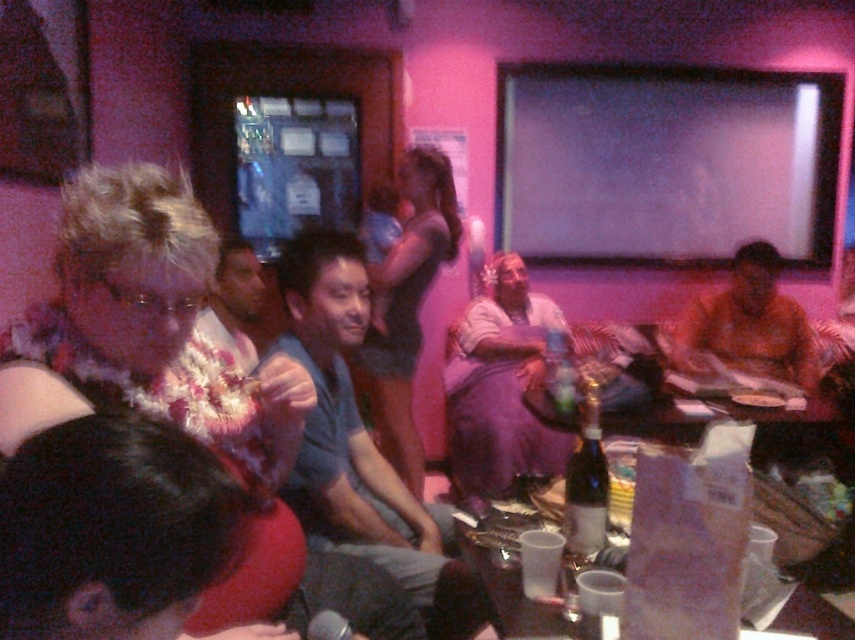
You are a photographer at the event and want to capture both the gray cotton shirt at center and the purple fabric dress at center in a single frame. Which of the two clothing items will appear shorter in the photo?

The gray cotton shirt at center will appear shorter in the photo because it has a lesser height compared to the purple fabric dress at center.

You are at a party and want to greet both the person wearing the gray cotton shirt at center and the person wearing the purple fabric dress at center. Which one should you approach first if you want to start with the person on the left side?

You should approach the gray cotton shirt at center first because it is to the left of the purple fabric dress at center.

You are at a party and want to take a photo of the white floral lei at center and the beige fabric shirt at center. Which one should you focus on first if you want to capture both in the same frame without moving the camera?

You should focus on the beige fabric shirt at center first because the white floral lei at center is located below it, so adjusting the focus to the shirt ensures both are in the frame.